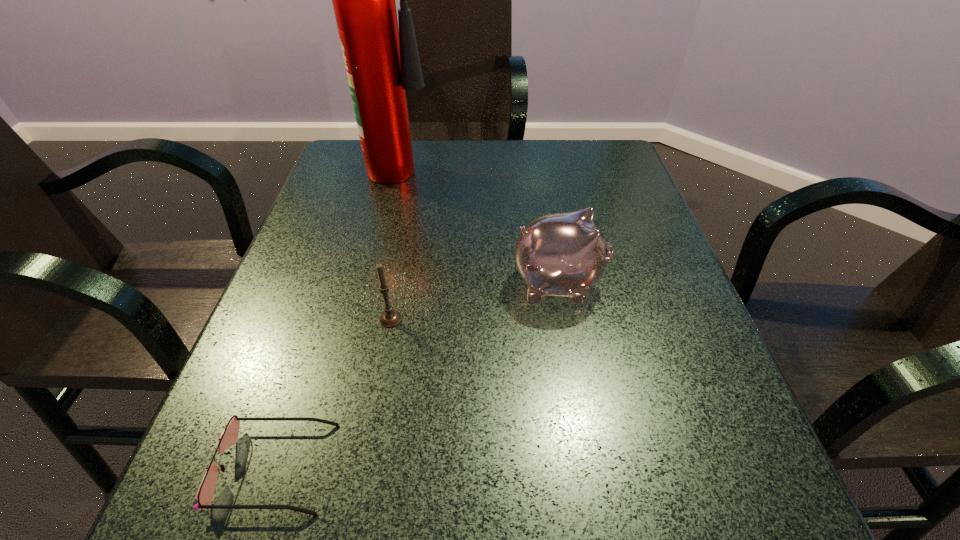
I want to click on free space that satisfies the following two spatial constraints: 1. on the back side of the candle; 2. at the nozzle of the fire extinguisher, so (x=420, y=164).